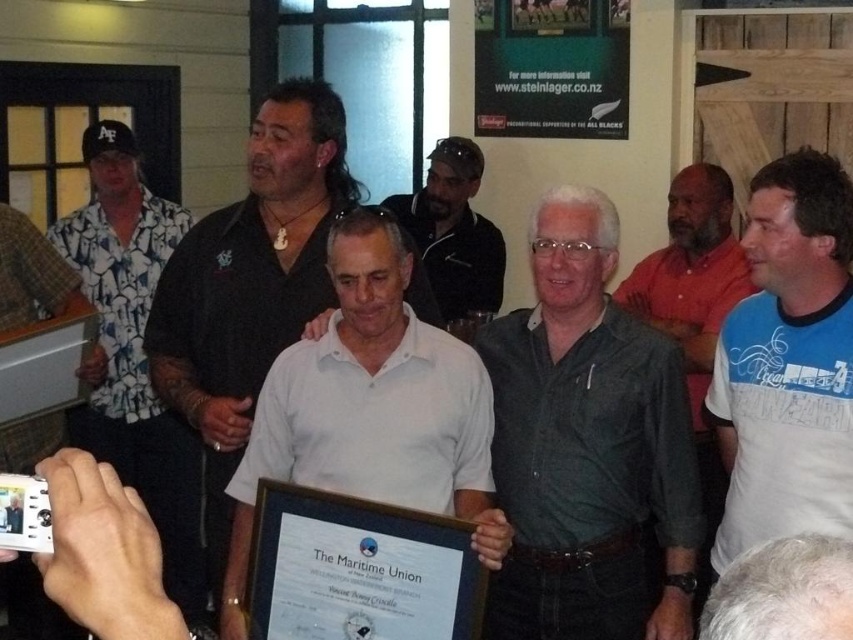
Which is behind, point (416, 492) or point (497, 284)?

The point (497, 284) is more distant.

Who is lower down, white matte shirt at center or dark green shirt at center?

white matte shirt at center is lower down.

Between point (398, 442) and point (440, 294), which one is positioned behind?

The point (440, 294) is more distant.

The width and height of the screenshot is (853, 640). I want to click on white matte shirt at center, so click(370, 406).

Can you confirm if white printed shirt at left is thinner than dark green shirt at center?

No, white printed shirt at left is not thinner than dark green shirt at center.

The image size is (853, 640). Describe the element at coordinates (132, 353) in the screenshot. I see `white printed shirt at left` at that location.

Find the location of a particular element. white printed shirt at left is located at coordinates (132, 353).

Is the position of white matte shirt at center more distant than that of gray hair at center?

Yes, it is.

Does white matte shirt at center lie in front of gray hair at center?

No.

Does point (451, 368) lie behind point (799, 566)?

Yes.

The width and height of the screenshot is (853, 640). I want to click on white matte shirt at center, so click(370, 406).